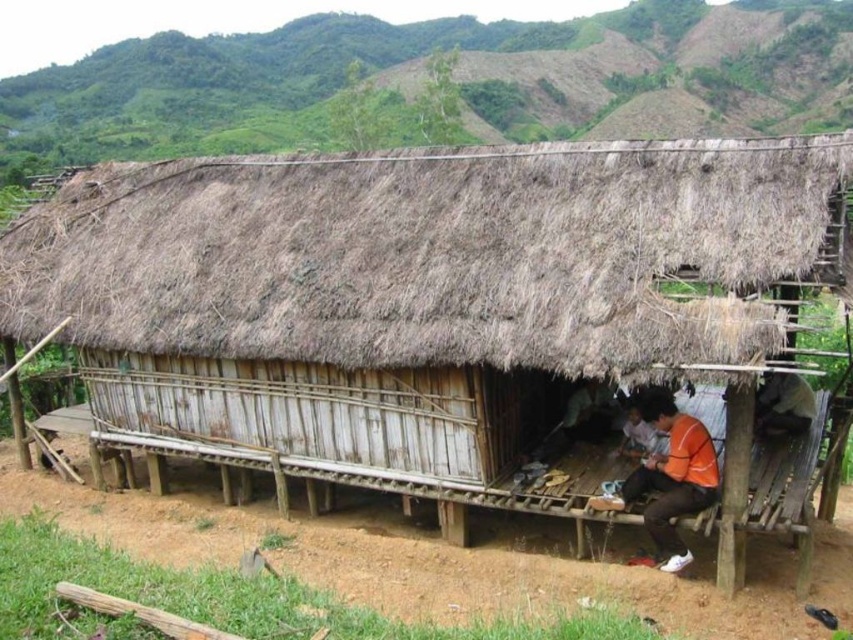
Question: Is brown thatch at center positioned behind orange fabric shirt at lower center?

Choices:
 (A) yes
 (B) no

Answer: (B)

Question: Estimate the real-world distances between objects in this image. Which object is farther from the green grassy hillside at upper center?

Choices:
 (A) brown thatch at center
 (B) orange fabric shirt at lower center

Answer: (B)

Question: Among these points, which one is nearest to the camera?

Choices:
 (A) (778, 344)
 (B) (799, 67)
 (C) (705, 458)

Answer: (A)

Question: Is brown thatch at center smaller than green grassy hillside at upper center?

Choices:
 (A) yes
 (B) no

Answer: (A)

Question: Which point is closer to the camera?

Choices:
 (A) orange fabric shirt at lower center
 (B) brown thatch at center

Answer: (B)

Question: In this image, where is brown thatch at center located relative to orange fabric shirt at lower center?

Choices:
 (A) right
 (B) left

Answer: (B)